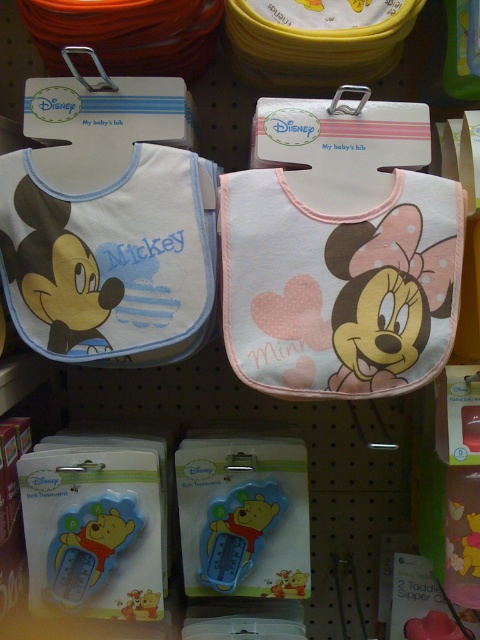
You are a store employee who needs to reach the point at coordinates [132,250] to adjust a display. Your arm can extend 70 centimeters. Can you reach that point without moving closer?

The point at coordinates [132,250] is 85.94 centimeters away from the camera, which is beyond the 70 centimeter reach of your arm. Therefore, you cannot reach it without moving closer.

You are a parent looking to choose a bib for your baby. You want to ensure the bib is not too large to avoid choking hazards. Which bib, the pastel pink fabric minnie mouse bib at center or the matte white bib at center, is smaller in size?

The pastel pink fabric minnie mouse bib at center is smaller in size compared to the matte white bib at center, making it a safer choice to avoid choking hazards.

You are a store employee organizing the Disney baby items section. You need to place a new item between the matte white bib at center and the blue rubber thermometer at center. The new item must be taller than the thermometer but shorter than the bib. Is this possible?

The matte white bib at center is taller than the blue rubber thermometer at center. Since the new item needs to be taller than the thermometer but shorter than the bib, it is possible to place such an item between them as long as its height falls within that range.